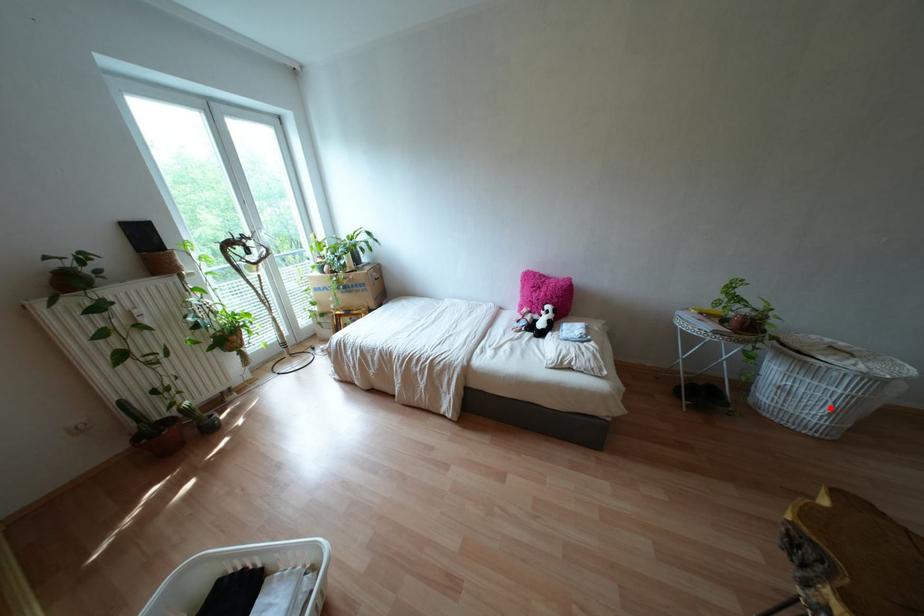
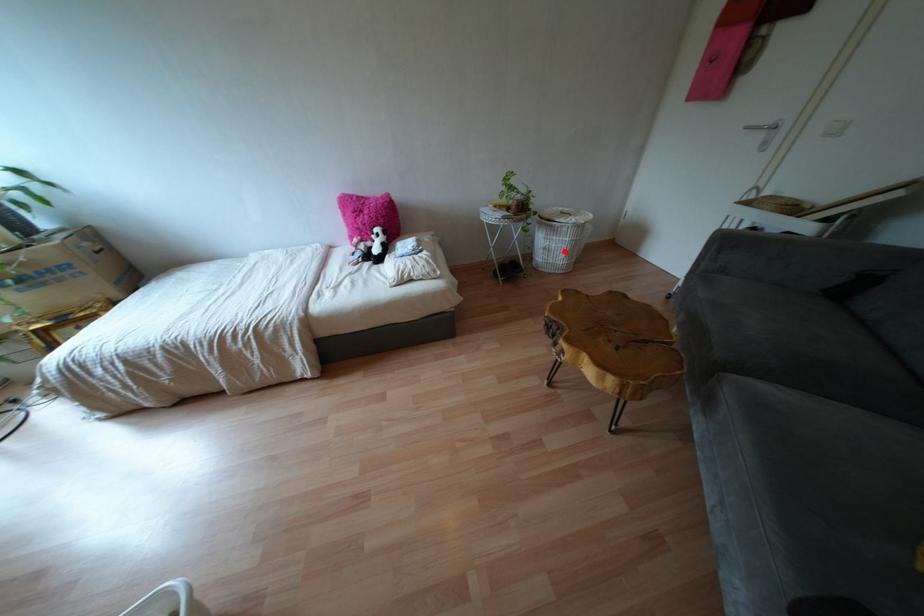
I am providing you with two images of the same scene from different viewpoints. A red point is marked on the first image and another point is marked on the second image. Are the points marked in image1 and image2 representing the same 3D position?

Yes